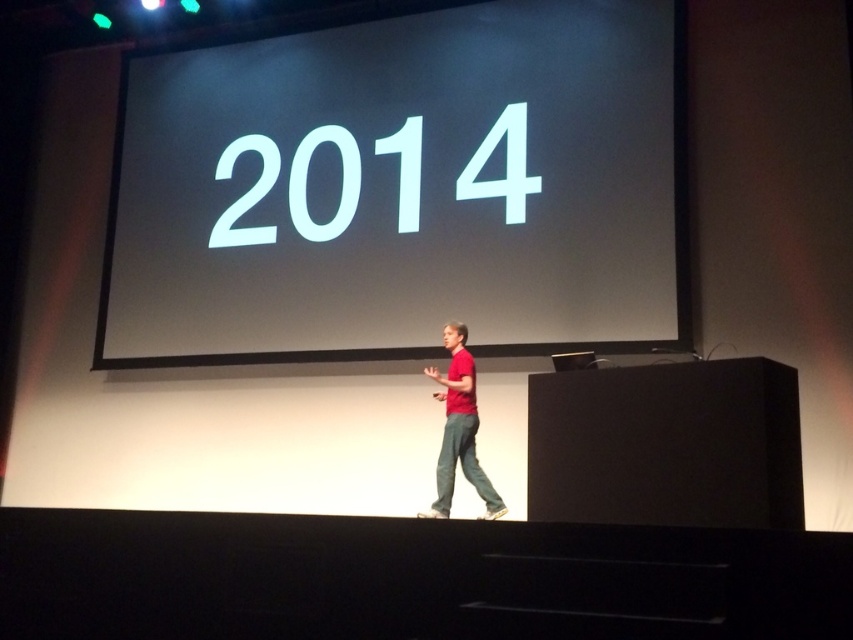
You are an event planner standing at the back of the room and want to ensure that the speaker can be seen clearly by the audience. Given that the white glossy projection screen at upper center and the red matte shirt at center are 5.68 feet apart, is the distance between them sufficient for the audience to see both the speaker and the screen comfortably?

The white glossy projection screen at upper center and the red matte shirt at center are 5.68 feet apart. This distance is sufficient for the audience to comfortably see both the speaker and the screen as they are positioned apart enough to avoid obstruction while maintaining visibility.

You are an attendee at this presentation. You notice the white glossy projection screen at upper center and the red matte shirt at center. Which object is positioned to the right of the other?

The white glossy projection screen at upper center is to the right of the red matte shirt at center.

Based on the scene description, where is the white glossy projection screen at upper center located in terms of its 2D coordinates?

The white glossy projection screen at upper center is located at the 2D coordinates of point (x=402, y=188).